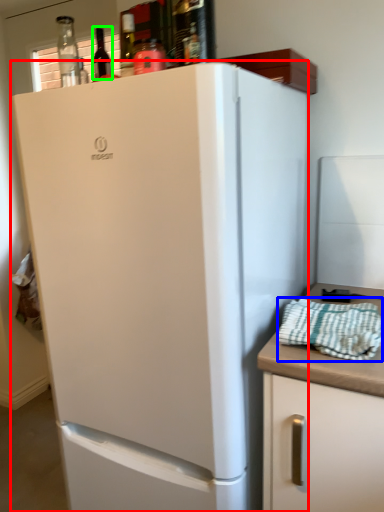
Question: Estimate the real-world distances between objects in this image. Which object is closer to refrigerator (highlighted by a red box), blanket (highlighted by a blue box) or wine bottle (highlighted by a green box)?

Choices:
 (A) blanket
 (B) wine bottle

Answer: (A)